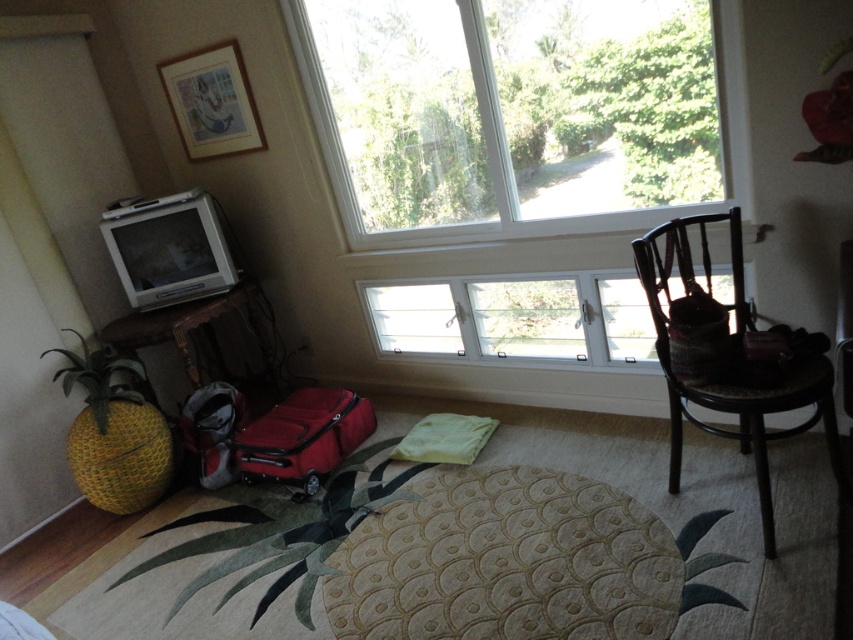
Question: Considering the real-world distances, which object is closest to the clear glass window at upper center?

Choices:
 (A) matte red suitcase at center
 (B) dark brown woven chair at right

Answer: (B)

Question: Which point appears closest to the camera in this image?

Choices:
 (A) (332, 436)
 (B) (813, 413)
 (C) (500, 157)

Answer: (B)

Question: Is clear glass window at upper center below dark brown woven chair at right?

Choices:
 (A) no
 (B) yes

Answer: (A)

Question: In this image, where is dark brown woven chair at right located relative to matte red suitcase at center?

Choices:
 (A) below
 (B) above

Answer: (B)

Question: Estimate the real-world distances between objects in this image. Which object is closer to the clear glass window at upper center?

Choices:
 (A) dark brown woven chair at right
 (B) matte red suitcase at center

Answer: (A)

Question: Is clear glass window at upper center thinner than dark brown woven chair at right?

Choices:
 (A) no
 (B) yes

Answer: (A)